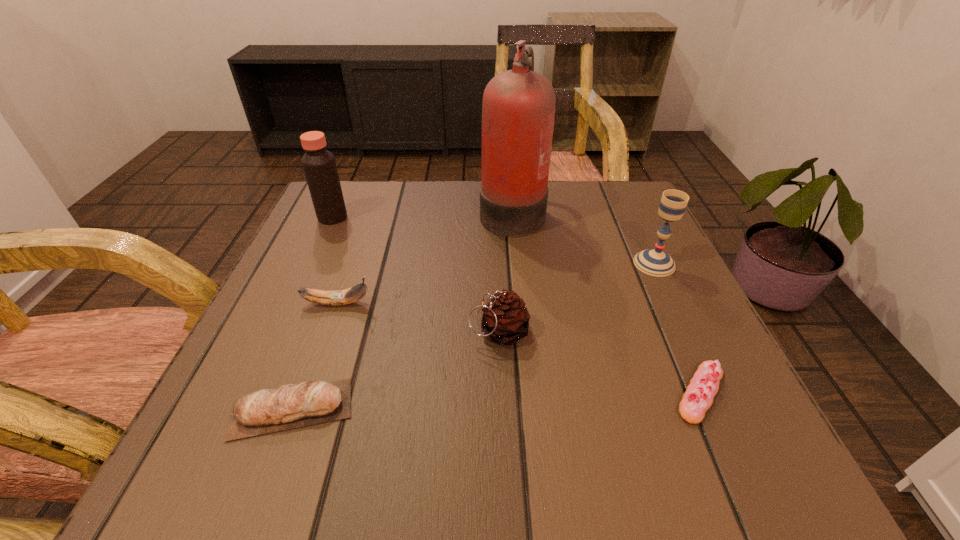
The width and height of the screenshot is (960, 540). Identify the location of vacant region located at the nozzle of the fire extinguisher. (441, 211).

Identify the location of vacant region located at the nozzle of the fire extinguisher. (420, 211).

Locate an element on the screen. The height and width of the screenshot is (540, 960). vacant region located 0.220m at the nozzle of the fire extinguisher is located at coordinates click(385, 211).

Locate an element on the screen. The height and width of the screenshot is (540, 960). free space located on the back of the second tallest object is located at coordinates coord(342,196).

Locate an element on the screen. Image resolution: width=960 pixels, height=540 pixels. blank space located 0.050m on the left of the third farthest object is located at coordinates (609, 264).

Where is `vacant space located 0.140m with a leaf charm attached to the fifth farthest object`? Image resolution: width=960 pixels, height=540 pixels. vacant space located 0.140m with a leaf charm attached to the fifth farthest object is located at coordinates (386, 331).

Find the location of `free region located 0.340m with a leaf charm attached to the fifth farthest object`. free region located 0.340m with a leaf charm attached to the fifth farthest object is located at coordinates (267, 331).

Image resolution: width=960 pixels, height=540 pixels. In order to click on free space located with a leaf charm attached to the fifth farthest object in this screenshot , I will do `click(416, 331)`.

You are a GUI agent. You are given a task and a screenshot of the screen. Output one action in this format:
    pyautogui.click(x=<x>, y=<y>)
    Task: Click on the free spot located on the peel of the fourth farthest object
    
    Given the screenshot: What is the action you would take?
    pyautogui.click(x=478, y=303)

The image size is (960, 540). Find the location of `free space located on the right of the second shortest object`. free space located on the right of the second shortest object is located at coordinates (612, 409).